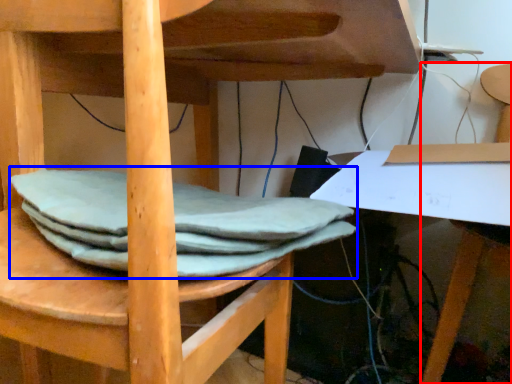
Question: Which object is closer to the camera taking this photo, chair (highlighted by a red box) or fabric (highlighted by a blue box)?

Choices:
 (A) chair
 (B) fabric

Answer: (B)